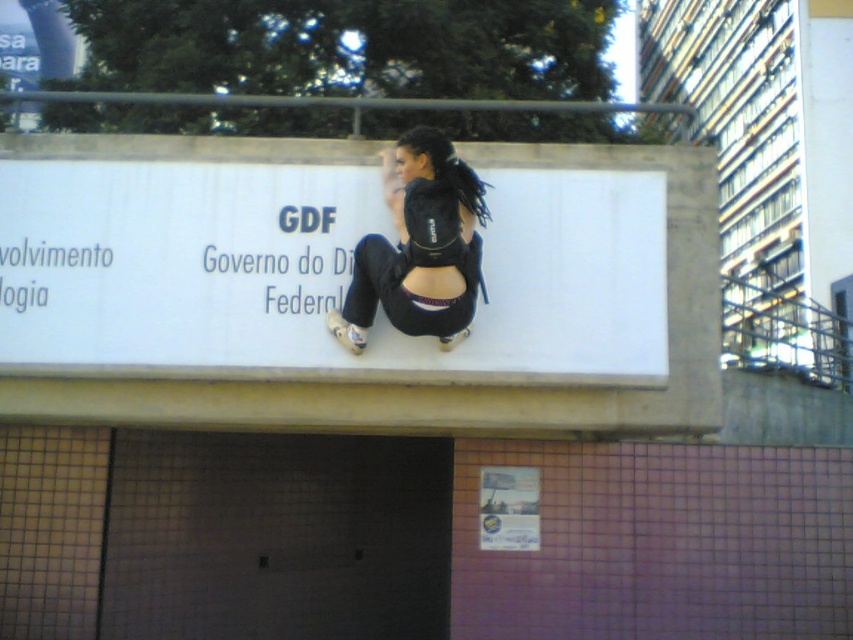
Question: Is white matte billboard at center to the right of black fabric backpack at center from the viewer's perspective?

Choices:
 (A) yes
 (B) no

Answer: (B)

Question: Where is white matte billboard at center located in relation to black fabric backpack at center in the image?

Choices:
 (A) above
 (B) below

Answer: (B)

Question: Does white matte billboard at center have a smaller size compared to black fabric backpack at center?

Choices:
 (A) yes
 (B) no

Answer: (B)

Question: Which point appears farthest from the camera in this image?

Choices:
 (A) (438, 180)
 (B) (589, 358)

Answer: (B)